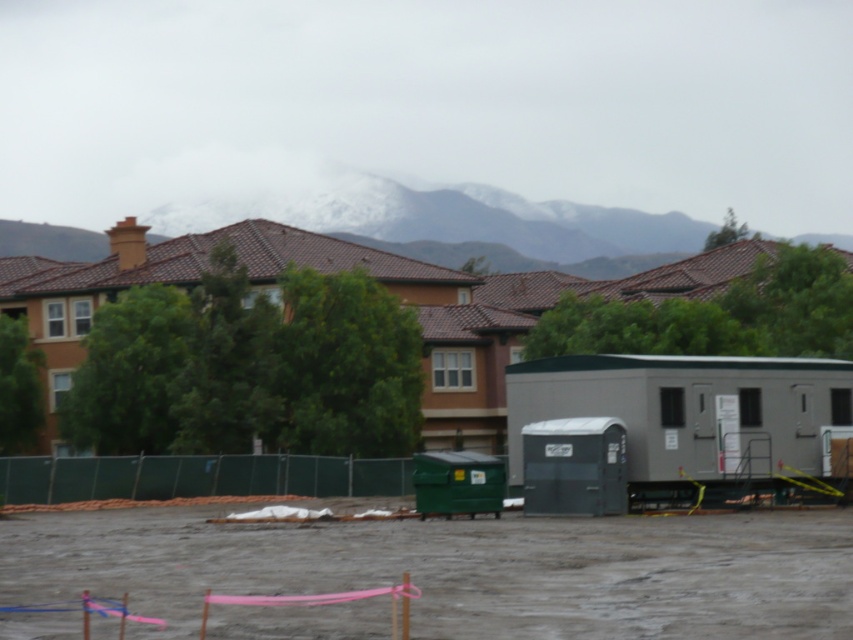
Is point (344, 195) in front of point (297, 493)?

No, it is not.

Based on the photo, which of these two, snowy mountain at upper center or green mesh fence at lower center, stands taller?

snowy mountain at upper center

Does point (167, 230) come in front of point (51, 481)?

No, it is not.

Where is `snowy mountain at upper center`? This screenshot has width=853, height=640. snowy mountain at upper center is located at coordinates (500, 227).